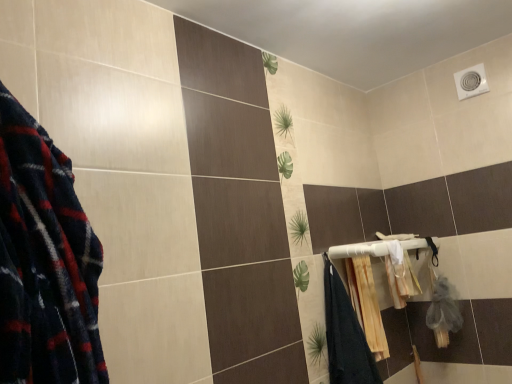
The height and width of the screenshot is (384, 512). What are the coordinates of `white plastic towel bar at upper right` in the screenshot? It's located at (359, 250).

In order to click on white fabric bath towel at lower right, placed as the 2th bath towel when sorted from left to right in this screenshot , I will do `click(401, 278)`.

Does white plastic towel bar at upper right come behind white fabric bath towel at lower right, which is counted as the 1th bath towel, starting from the right?

No, white plastic towel bar at upper right is in front of white fabric bath towel at lower right, which is counted as the 1th bath towel, starting from the right.

Is white plastic towel bar at upper right aimed at white fabric bath towel at lower right, which is counted as the 1th bath towel, starting from the right?

No.

Considering the relative sizes of white plastic towel bar at upper right and white fabric bath towel at lower right, placed as the 2th bath towel when sorted from left to right, in the image provided, is white plastic towel bar at upper right taller than white fabric bath towel at lower right, placed as the 2th bath towel when sorted from left to right,?

No.

From the image's perspective, is white plastic towel bar at upper right located beneath white fabric bath towel at lower right, which is counted as the 1th bath towel, starting from the right?

No, from the image's perspective, white plastic towel bar at upper right is not beneath white fabric bath towel at lower right, which is counted as the 1th bath towel, starting from the right.

Is white fabric bath towel at lower right, which is counted as the 1th bath towel, starting from the right, at the left side of white plastic towel bar at upper right?

No.

Where is `towel bar located on the left of white fabric bath towel at lower right, placed as the 2th bath towel when sorted from left to right`? towel bar located on the left of white fabric bath towel at lower right, placed as the 2th bath towel when sorted from left to right is located at coordinates (359, 250).

Is white fabric bath towel at lower right, which is counted as the 1th bath towel, starting from the right, further to the viewer compared to white plastic towel bar at upper right?

Yes, white fabric bath towel at lower right, which is counted as the 1th bath towel, starting from the right, is further from the camera.

From the picture: Is white fabric bath towel at lower right, placed as the 2th bath towel when sorted from left to right, bigger than white plastic towel bar at upper right?

No, white fabric bath towel at lower right, placed as the 2th bath towel when sorted from left to right, is not bigger than white plastic towel bar at upper right.

Are white fabric bath towel at lower right, which is counted as the 1th bath towel, starting from the right, and beige textured towel at lower right, acting as the first bath towel starting from the left, far apart?

They are positioned close to each other.

From the image's perspective, who appears lower, white fabric bath towel at lower right, placed as the 2th bath towel when sorted from left to right, or beige textured towel at lower right, which is the second bath towel in right-to-left order?

beige textured towel at lower right, which is the second bath towel in right-to-left order, is shown below in the image.

From the picture: Is white fabric bath towel at lower right, which is counted as the 1th bath towel, starting from the right, shorter than beige textured towel at lower right, acting as the first bath towel starting from the left?

Indeed, white fabric bath towel at lower right, which is counted as the 1th bath towel, starting from the right, has a lesser height compared to beige textured towel at lower right, acting as the first bath towel starting from the left.

Between white fabric bath towel at lower right, which is counted as the 1th bath towel, starting from the right, and beige textured towel at lower right, acting as the first bath towel starting from the left, which one has larger size?

With larger size is beige textured towel at lower right, acting as the first bath towel starting from the left.

Can you confirm if beige textured towel at lower right, which is the second bath towel in right-to-left order, is wider than white plastic towel bar at upper right?

No.

Can you confirm if beige textured towel at lower right, acting as the first bath towel starting from the left, is bigger than white plastic towel bar at upper right?

No.

Could you tell me if beige textured towel at lower right, acting as the first bath towel starting from the left, is turned towards white plastic towel bar at upper right?

No, beige textured towel at lower right, acting as the first bath towel starting from the left, is not oriented towards white plastic towel bar at upper right.

From the image's perspective, is beige textured towel at lower right, acting as the first bath towel starting from the left, located beneath white plastic towel bar at upper right?

Yes.

How distant is beige textured towel at lower right, acting as the first bath towel starting from the left, from white fabric bath towel at lower right, placed as the 2th bath towel when sorted from left to right?

beige textured towel at lower right, acting as the first bath towel starting from the left, and white fabric bath towel at lower right, placed as the 2th bath towel when sorted from left to right, are 11.87 inches apart from each other.

Which is behind, point (351, 293) or point (408, 293)?

Point (408, 293)

From the image's perspective, between beige textured towel at lower right, acting as the first bath towel starting from the left, and white fabric bath towel at lower right, which is counted as the 1th bath towel, starting from the right, which one is located above?

white fabric bath towel at lower right, which is counted as the 1th bath towel, starting from the right, from the image's perspective.

Which of these two, beige textured towel at lower right, which is the second bath towel in right-to-left order, or white fabric bath towel at lower right, which is counted as the 1th bath towel, starting from the right, stands taller?

beige textured towel at lower right, which is the second bath towel in right-to-left order, is taller.

How far apart are white plastic towel bar at upper right and beige textured towel at lower right, which is the second bath towel in right-to-left order?

A distance of 8.35 inches exists between white plastic towel bar at upper right and beige textured towel at lower right, which is the second bath towel in right-to-left order.

From the picture: Between white plastic towel bar at upper right and beige textured towel at lower right, which is the second bath towel in right-to-left order, which one appears on the left side from the viewer's perspective?

Positioned to the left is beige textured towel at lower right, which is the second bath towel in right-to-left order.

Which is behind, white plastic towel bar at upper right or beige textured towel at lower right, acting as the first bath towel starting from the left?

beige textured towel at lower right, acting as the first bath towel starting from the left, is behind.

Is white plastic towel bar at upper right looking in the opposite direction of beige textured towel at lower right, acting as the first bath towel starting from the left?

No.

Locate an element on the screen. The height and width of the screenshot is (384, 512). towel bar above the white fabric bath towel at lower right, which is counted as the 1th bath towel, starting from the right (from a real-world perspective) is located at coordinates (359, 250).

The image size is (512, 384). What are the coordinates of `towel bar on the left side of white fabric bath towel at lower right, which is counted as the 1th bath towel, starting from the right` in the screenshot? It's located at (359, 250).

From the picture: Looking at the image, which one is located closer to white plastic towel bar at upper right, beige textured towel at lower right, acting as the first bath towel starting from the left, or white fabric bath towel at lower right, which is counted as the 1th bath towel, starting from the right?

The object closer to white plastic towel bar at upper right is white fabric bath towel at lower right, which is counted as the 1th bath towel, starting from the right.

Looking at the image, which one is located further to beige textured towel at lower right, which is the second bath towel in right-to-left order, white fabric bath towel at lower right, placed as the 2th bath towel when sorted from left to right, or white plastic towel bar at upper right?

white fabric bath towel at lower right, placed as the 2th bath towel when sorted from left to right.

Looking at the image, which one is located further to white plastic towel bar at upper right, white fabric bath towel at lower right, which is counted as the 1th bath towel, starting from the right, or beige textured towel at lower right, which is the second bath towel in right-to-left order?

Among the two, beige textured towel at lower right, which is the second bath towel in right-to-left order, is located further to white plastic towel bar at upper right.

Considering their positions, is beige textured towel at lower right, acting as the first bath towel starting from the left, positioned further to white fabric bath towel at lower right, placed as the 2th bath towel when sorted from left to right, than white plastic towel bar at upper right?

beige textured towel at lower right, acting as the first bath towel starting from the left, is further to white fabric bath towel at lower right, placed as the 2th bath towel when sorted from left to right.

Estimate the real-world distances between objects in this image. Which object is further from beige textured towel at lower right, which is the second bath towel in right-to-left order, white plastic towel bar at upper right or white fabric bath towel at lower right, placed as the 2th bath towel when sorted from left to right?

The object further to beige textured towel at lower right, which is the second bath towel in right-to-left order, is white fabric bath towel at lower right, placed as the 2th bath towel when sorted from left to right.

From the image, which object appears to be nearer to white fabric bath towel at lower right, which is counted as the 1th bath towel, starting from the right, white plastic towel bar at upper right or beige textured towel at lower right, which is the second bath towel in right-to-left order?

Among the two, white plastic towel bar at upper right is located nearer to white fabric bath towel at lower right, which is counted as the 1th bath towel, starting from the right.

I want to click on bath towel between white plastic towel bar at upper right and white fabric bath towel at lower right, which is counted as the 1th bath towel, starting from the right, from front to back, so click(x=367, y=304).